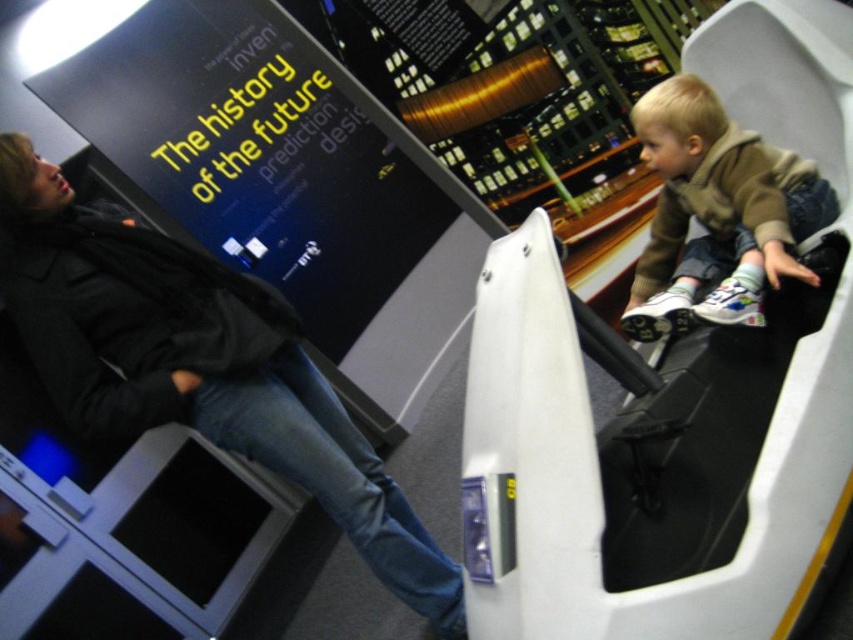
You are a security guard at the museum and need to locate the dark gray jacket at upper left. According to the coordinates provided, where exactly is it positioned?

The dark gray jacket at upper left is located at point (196,365).

Looking at this image, you are standing in the center of the exhibit and want to move to the exit door located behind the light brown fleece jacket at upper right. Is the dark gray jacket at upper left blocking your path?

The dark gray jacket at upper left is to the left of the light brown fleece jacket at upper right, so it is not blocking the path to the exit door behind the light brown fleece jacket at upper right.

You are standing in front of an interactive exhibit and see two points marked on the floor. The first point is at coordinate point (24, 173) and the second point is at coordinate point (701, 192). Which point is closer to you?

Point (24, 173) is closer to the viewer than point (701, 192).